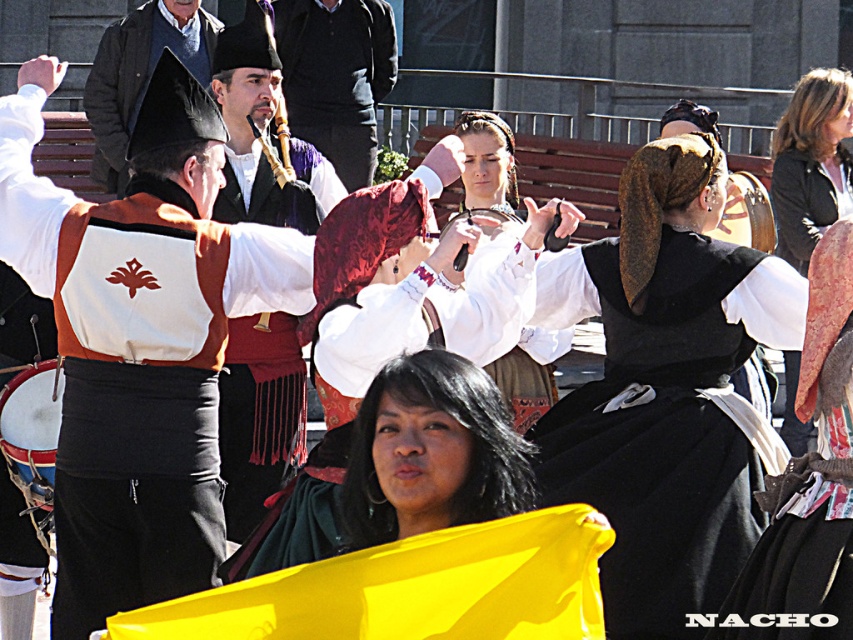
Question: Does black velvet shawl at lower center appear over matte black hat at upper left?

Choices:
 (A) yes
 (B) no

Answer: (B)

Question: Is matte black hat at center to the left of black velvet shawl at lower center from the viewer's perspective?

Choices:
 (A) no
 (B) yes

Answer: (B)

Question: Which point is farther from the camera taking this photo?

Choices:
 (A) (386, 35)
 (B) (583, 420)
 (C) (520, 445)

Answer: (A)

Question: Which point is farther from the camera taking this photo?

Choices:
 (A) (726, 337)
 (B) (374, 502)

Answer: (A)

Question: Does black velvet shawl at lower center lie behind smooth purple vest at center?

Choices:
 (A) yes
 (B) no

Answer: (B)

Question: Which of the following is the closest to the observer?

Choices:
 (A) tap(270, 204)
 (B) tap(321, 116)
 (C) tap(511, 362)

Answer: (C)